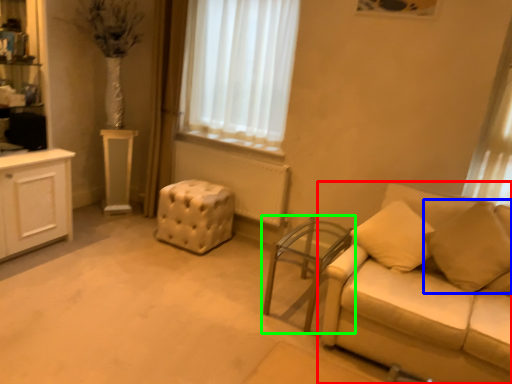
Question: Estimate the real-world distances between objects in this image. Which object is farther from studio couch (highlighted by a red box), pillow (highlighted by a blue box) or table (highlighted by a green box)?

Choices:
 (A) pillow
 (B) table

Answer: (B)